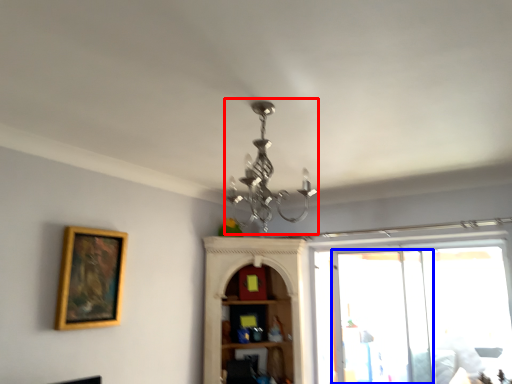
Question: Which object appears farthest to the camera in this image, light fixture (highlighted by a red box) or screen door (highlighted by a blue box)?

Choices:
 (A) light fixture
 (B) screen door

Answer: (B)